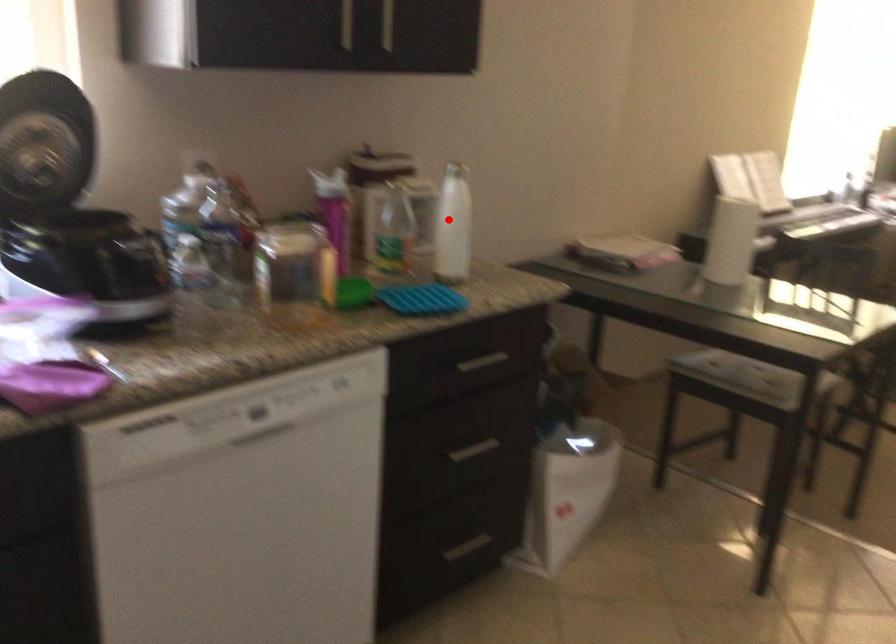
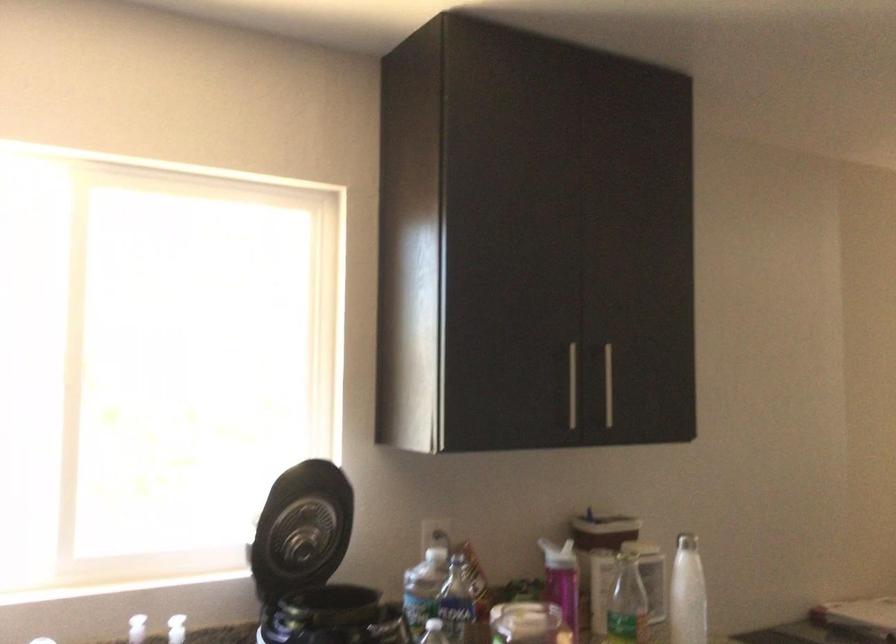
In the second image, find the point that corresponds to the highlighted location in the first image.

(687, 592)